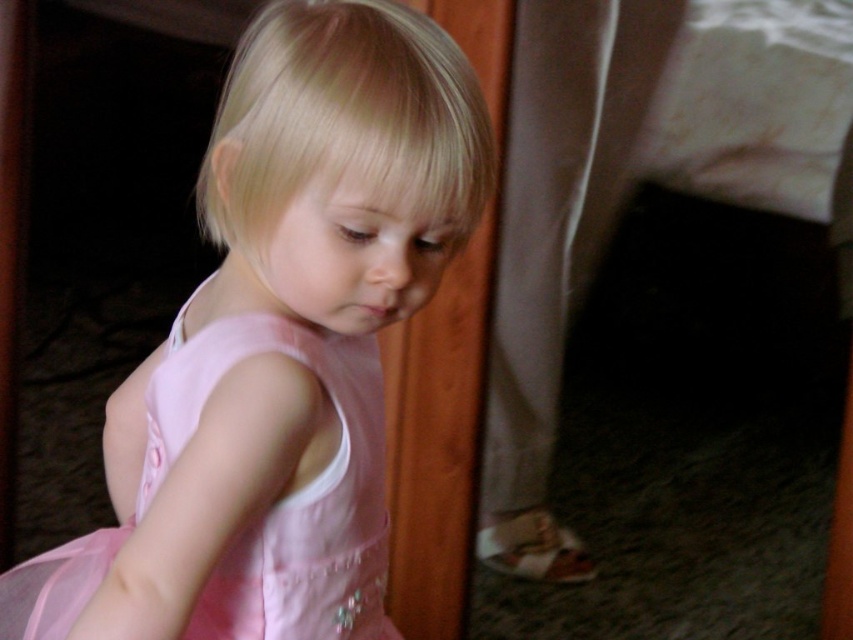
Question: Which point is farther to the camera?

Choices:
 (A) pink satin dress at center
 (B) pink tulle dress at center

Answer: (B)

Question: Which point is closer to the camera?

Choices:
 (A) (93, 532)
 (B) (187, 308)

Answer: (B)

Question: Is pink satin dress at center further to the viewer compared to pink tulle dress at center?

Choices:
 (A) no
 (B) yes

Answer: (A)

Question: Is pink satin dress at center wider than pink tulle dress at center?

Choices:
 (A) no
 (B) yes

Answer: (B)

Question: In this image, where is pink satin dress at center located relative to pink tulle dress at center?

Choices:
 (A) below
 (B) above

Answer: (B)